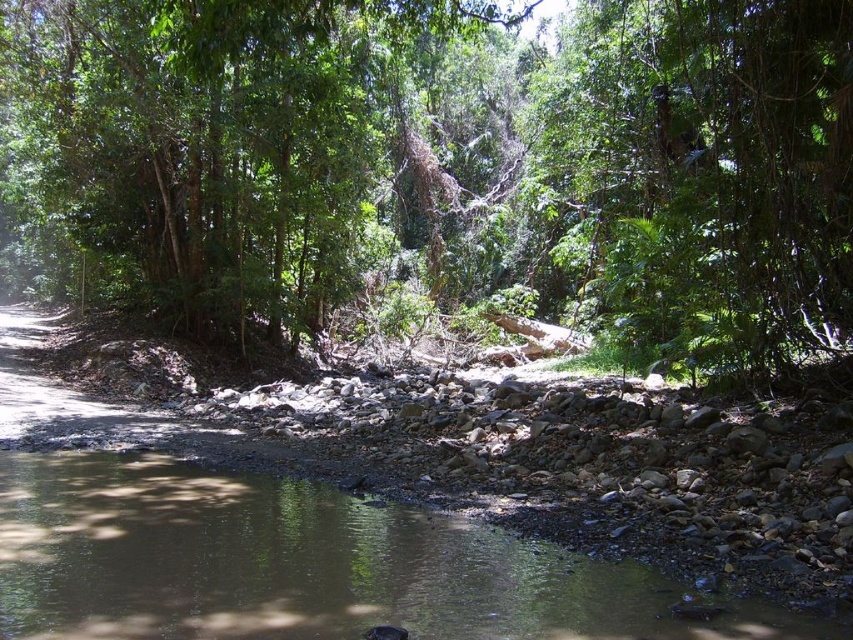
Consider the image. You are standing at the edge of the brown gravel river at lower left and want to reach the green leafy tree at center. Which direction should you move to get closer to the tree?

To reach the green leafy tree at center from the brown gravel river at lower left, you should move towards the center of the image since the green leafy tree at center is further to the viewer than the brown gravel river at lower left.

You are standing at the edge of the brown gravel river at lower left and want to reach the green leafy tree at center. Considering the size difference between them, which direction should you head towards to get closer to the tree?

The green leafy tree at center is larger in size than the brown gravel river at lower left. To reach the tree, you should head towards the center of the scene where the tree is located, moving away from the river at lower left.

You are standing at the edge of the brown gravel river at lower left and want to reach the green leafy tree at center. Which direction should you move to get closer to the tree?

To reach the green leafy tree at center from the brown gravel river at lower left, you should move upward since the green leafy tree at center is above the brown gravel river at lower left.